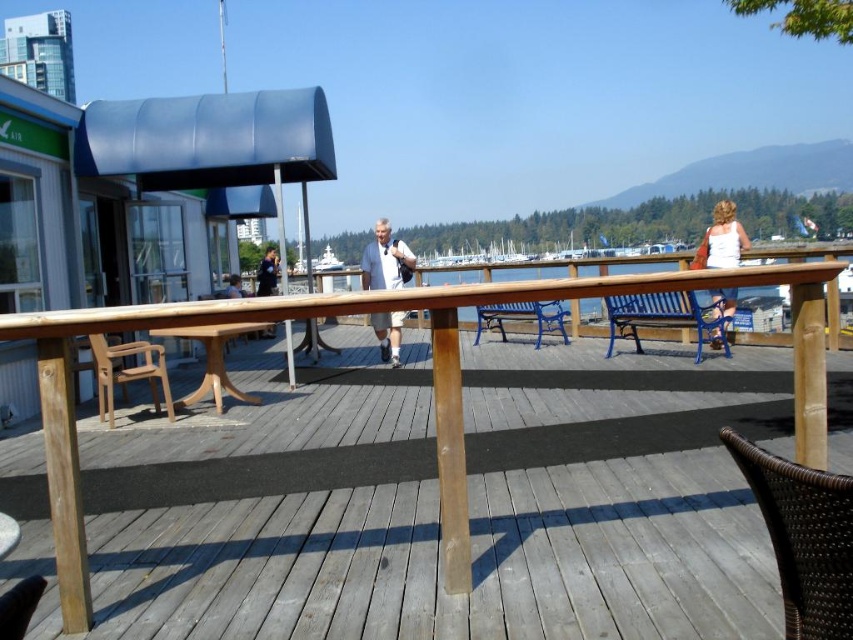
Is wooden chair at left positioned behind white fabric dress at upper right?

That is True.

Between wooden chair at left and white fabric dress at upper right, which one appears on the right side from the viewer's perspective?

Positioned to the right is white fabric dress at upper right.

What do you see at coordinates (126, 372) in the screenshot?
I see `wooden chair at left` at bounding box center [126, 372].

You are a GUI agent. You are given a task and a screenshot of the screen. Output one action in this format:
    pyautogui.click(x=<x>, y=<y>)
    Task: Click on the wooden chair at left
    Image resolution: width=853 pixels, height=640 pixels.
    Given the screenshot: What is the action you would take?
    pyautogui.click(x=126, y=372)

Who is shorter, brown woven chair at lower right or white fabric dress at upper right?

Standing shorter between the two is brown woven chair at lower right.

Based on the photo, is brown woven chair at lower right to the left of white fabric dress at upper right from the viewer's perspective?

Yes, brown woven chair at lower right is to the left of white fabric dress at upper right.

Is point (808, 624) closer to viewer compared to point (722, 262)?

That is True.

At what (x,y) coordinates should I click in order to perform the action: click on brown woven chair at lower right. Please return your answer as a coordinate pair (x, y). The width and height of the screenshot is (853, 640). Looking at the image, I should click on (804, 536).

Between natural wood table at center and white cotton shirt at center, which one appears on the right side from the viewer's perspective?

white cotton shirt at center

The height and width of the screenshot is (640, 853). What do you see at coordinates (430, 488) in the screenshot? I see `natural wood table at center` at bounding box center [430, 488].

Does point (167, 547) lie in front of point (370, 321)?

Yes.

The width and height of the screenshot is (853, 640). What are the coordinates of `natural wood table at center` in the screenshot? It's located at click(430, 488).